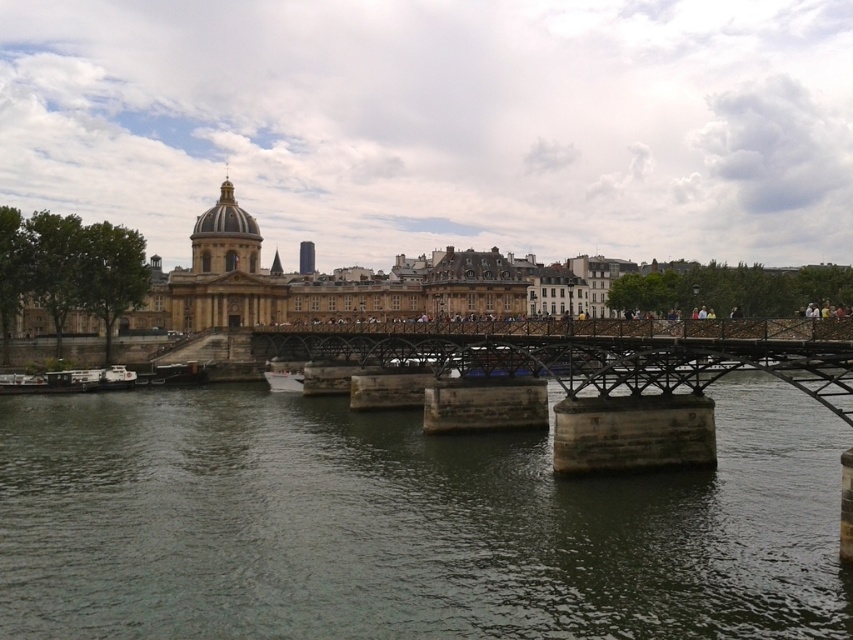
Question: Estimate the real-world distances between objects in this image. Which object is closer to the white glossy boat at center?

Choices:
 (A) dark gray concrete river at center
 (B) metallic bridge at center

Answer: (B)

Question: Which point appears farthest from the camera in this image?

Choices:
 (A) (747, 417)
 (B) (299, 346)

Answer: (B)

Question: Does metallic bridge at center have a smaller size compared to white glossy boat at center?

Choices:
 (A) yes
 (B) no

Answer: (B)

Question: Among these points, which one is farthest from the camera?

Choices:
 (A) (271, 374)
 (B) (688, 337)
 (C) (776, 564)

Answer: (A)

Question: Does dark gray concrete river at center have a smaller size compared to white glossy boat at center?

Choices:
 (A) no
 (B) yes

Answer: (A)

Question: Can you confirm if metallic bridge at center is thinner than white glossy boat at center?

Choices:
 (A) yes
 (B) no

Answer: (B)